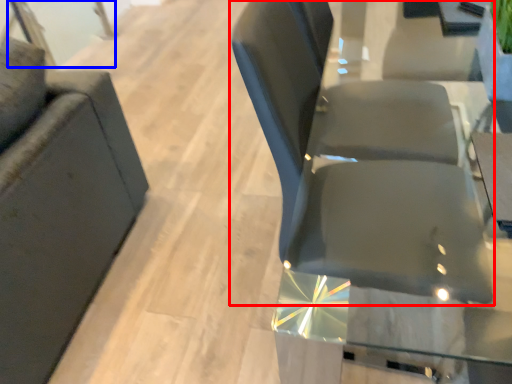
Question: Which object appears closest to the camera in this image, chair (highlighted by a red box) or glass door (highlighted by a blue box)?

Choices:
 (A) chair
 (B) glass door

Answer: (A)